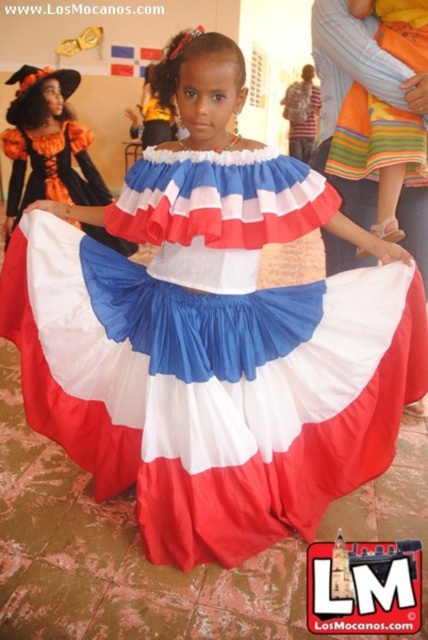
Question: Is striped cotton dress at center above matte fabric dress at center?

Choices:
 (A) yes
 (B) no

Answer: (A)

Question: From the image, what is the correct spatial relationship of striped cotton dress at center in relation to matte fabric dress at center?

Choices:
 (A) above
 (B) below

Answer: (A)

Question: Which point is farther to the camera?

Choices:
 (A) matte fabric dress at center
 (B) striped cotton dress at center

Answer: (A)

Question: Where is striped cotton dress at center located in relation to matte fabric dress at center in the image?

Choices:
 (A) above
 (B) below

Answer: (A)

Question: Among these objects, which one is nearest to the camera?

Choices:
 (A) matte fabric dress at center
 (B) striped cotton dress at center

Answer: (B)